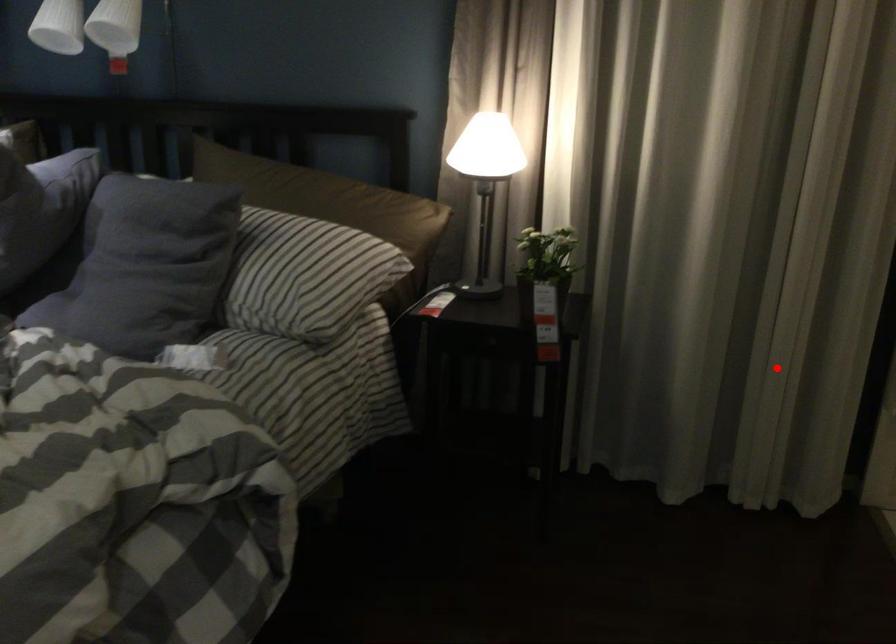
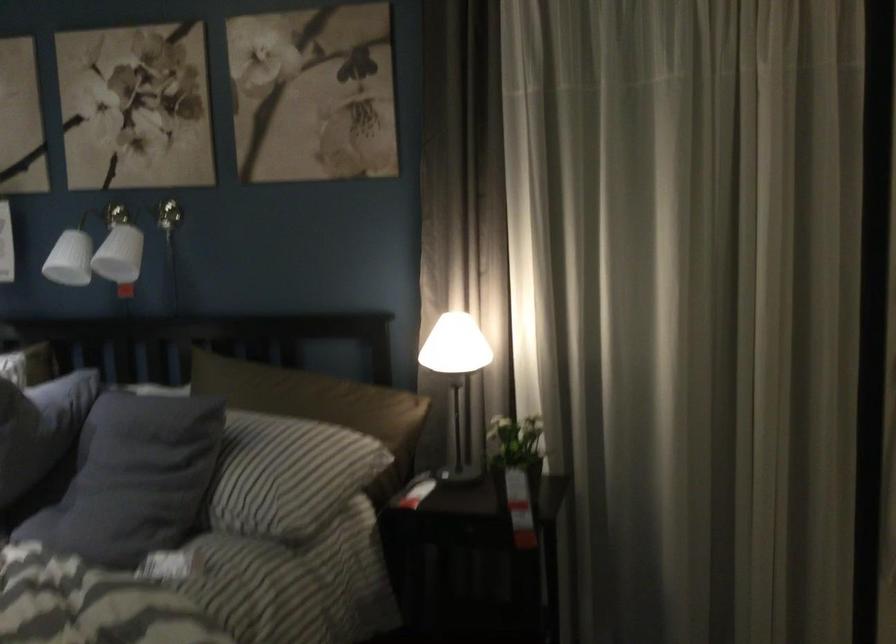
Locate, in the second image, the point that corresponds to the highlighted location in the first image.

(761, 540)